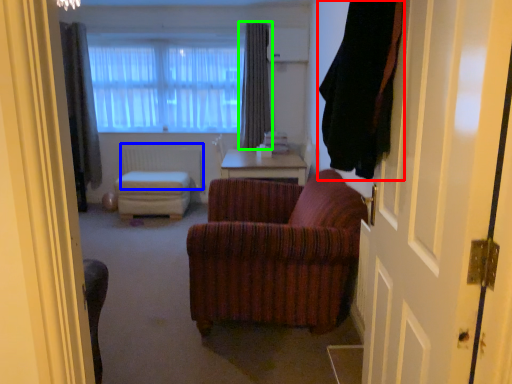
Question: Considering the real-world distances, which object is farthest from curtain (highlighted by a red box)? radiator (highlighted by a blue box) or curtain (highlighted by a green box)?

Choices:
 (A) radiator
 (B) curtain

Answer: (A)